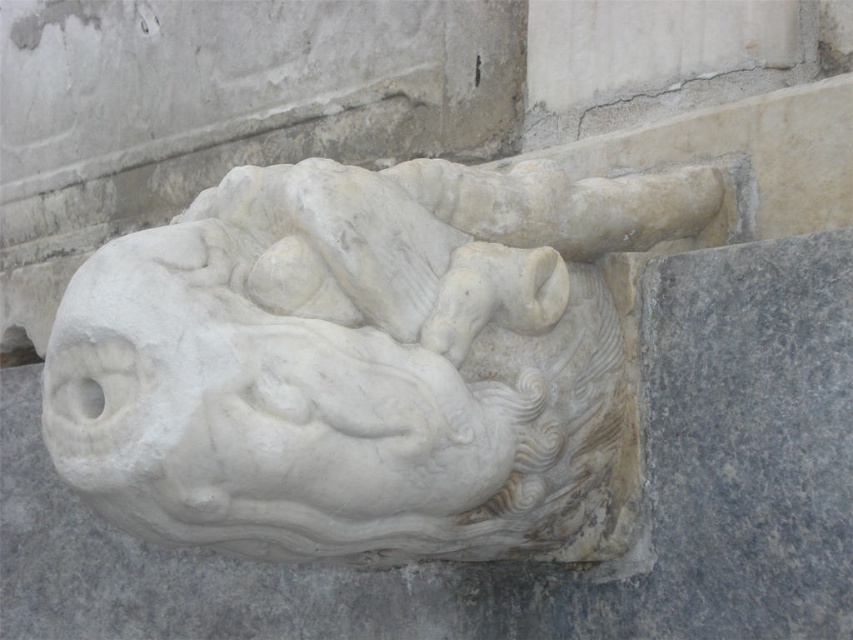
Which of these two, white marble horse at center or white marble horse head at center, stands taller?

white marble horse at center

Is point (291, 408) behind point (202, 426)?

Yes.

Where is `white marble horse at center`? white marble horse at center is located at coordinates (364, 362).